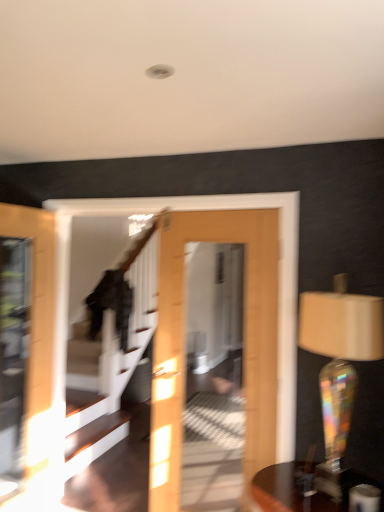
The image size is (384, 512). Describe the element at coordinates (348, 371) in the screenshot. I see `iridescent glass table lamp at right` at that location.

I want to click on iridescent glass table lamp at right, so click(x=348, y=371).

The height and width of the screenshot is (512, 384). Describe the element at coordinates (301, 490) in the screenshot. I see `wooden round table at lower right` at that location.

The width and height of the screenshot is (384, 512). What are the coordinates of `wooden round table at lower right` in the screenshot? It's located at (301, 490).

In order to click on iridescent glass table lamp at right in this screenshot , I will do tap(348, 371).

Considering the relative positions of iridescent glass table lamp at right and wooden round table at lower right in the image provided, is iridescent glass table lamp at right to the left of wooden round table at lower right from the viewer's perspective?

No, iridescent glass table lamp at right is not to the left of wooden round table at lower right.

In the image, is iridescent glass table lamp at right positioned in front of or behind wooden round table at lower right?

Clearly, iridescent glass table lamp at right is behind wooden round table at lower right.

Is point (332, 457) behind point (282, 505)?

Yes, it is behind point (282, 505).

From the image's perspective, between iridescent glass table lamp at right and wooden round table at lower right, which one is located above?

iridescent glass table lamp at right.

From a real-world perspective, which is physically above, iridescent glass table lamp at right or wooden round table at lower right?

From a 3D spatial view, iridescent glass table lamp at right is above.

Which of these two, iridescent glass table lamp at right or wooden round table at lower right, is thinner?

iridescent glass table lamp at right.

Between iridescent glass table lamp at right and wooden round table at lower right, which one has less height?

wooden round table at lower right is shorter.

Who is smaller, iridescent glass table lamp at right or wooden round table at lower right?

wooden round table at lower right.

Would you say iridescent glass table lamp at right is inside or outside wooden round table at lower right?

iridescent glass table lamp at right is outside wooden round table at lower right.

Is the surface of iridescent glass table lamp at right in direct contact with wooden round table at lower right?

No, iridescent glass table lamp at right is not beside wooden round table at lower right.

Looking at this image, is wooden round table at lower right at the back of iridescent glass table lamp at right?

No, iridescent glass table lamp at right's orientation is not away from wooden round table at lower right.

Where is `table lamp behind the wooden round table at lower right`? Image resolution: width=384 pixels, height=512 pixels. table lamp behind the wooden round table at lower right is located at coordinates (348, 371).

Which is more to the right, wooden round table at lower right or iridescent glass table lamp at right?

iridescent glass table lamp at right is more to the right.

Is the depth of wooden round table at lower right less than that of iridescent glass table lamp at right?

Yes.

Is point (285, 477) closer to camera compared to point (355, 429)?

Yes, it is.

From the image's perspective, would you say wooden round table at lower right is positioned over iridescent glass table lamp at right?

Incorrect, from the image's perspective, wooden round table at lower right is lower than iridescent glass table lamp at right.

From a real-world perspective, is wooden round table at lower right below iridescent glass table lamp at right?

Yes, from a real-world perspective, wooden round table at lower right is beneath iridescent glass table lamp at right.

Considering the relative sizes of wooden round table at lower right and iridescent glass table lamp at right in the image provided, is wooden round table at lower right thinner than iridescent glass table lamp at right?

In fact, wooden round table at lower right might be wider than iridescent glass table lamp at right.

Does wooden round table at lower right have a greater height compared to iridescent glass table lamp at right?

No.

Who is bigger, wooden round table at lower right or iridescent glass table lamp at right?

Bigger between the two is iridescent glass table lamp at right.

Would you say wooden round table at lower right is outside iridescent glass table lamp at right?

Yes, wooden round table at lower right is located beyond the bounds of iridescent glass table lamp at right.

Is wooden round table at lower right far away from iridescent glass table lamp at right?

Actually, wooden round table at lower right and iridescent glass table lamp at right are a little close together.

Is wooden round table at lower right positioned with its back to iridescent glass table lamp at right?

No, wooden round table at lower right is not facing away from iridescent glass table lamp at right.

Can you tell me how much wooden round table at lower right and iridescent glass table lamp at right differ in facing direction?

They differ by 0.741 degrees in their facing directions.

Find the location of a particular element. This screenshot has height=512, width=384. table lamp that appears on the right of wooden round table at lower right is located at coordinates [348, 371].

Find the location of `table lamp behind the wooden round table at lower right`. table lamp behind the wooden round table at lower right is located at coordinates (348, 371).

I want to click on table lamp located above the wooden round table at lower right (from a real-world perspective), so click(348, 371).